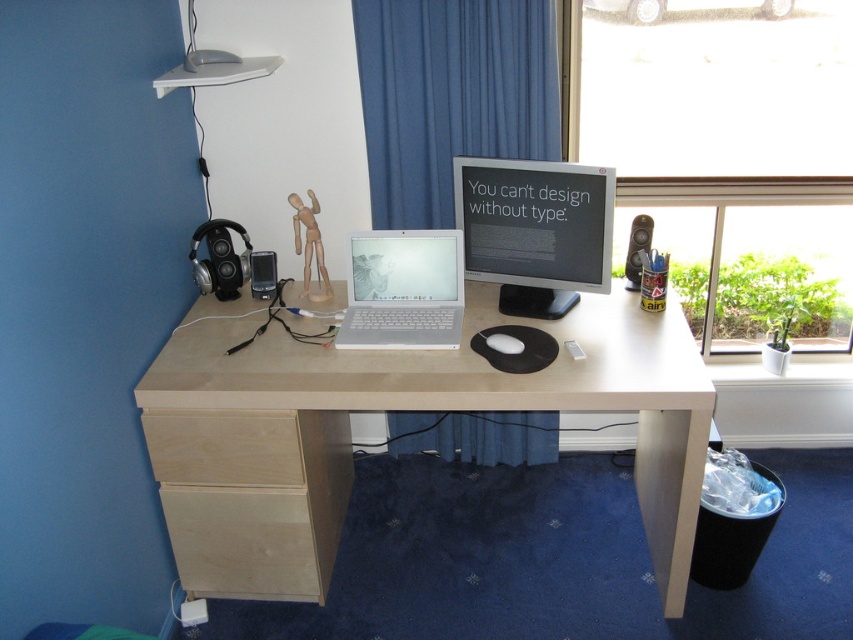
You are trying to determine if the transparent glass window at upper right can accommodate a sticker that is as wide as the silver metallic laptop at center. Based on the scene, can the sticker fit horizontally?

The transparent glass window at upper right is wider than the silver metallic laptop at center, so the sticker can fit horizontally.

You are a designer who needs to reach both the silver metallic laptop at center and the birch wood drawer at lower left simultaneously. Can you do so without moving your chair? The average human arm span is 1.5 meters.

The silver metallic laptop at center and birch wood drawer at lower left are 18.30 inches apart from each other. Since 18.30 inches is approximately 0.465 meters, which is well within the average human arm span of 1.5 meters, you can reach both items without moving your chair.